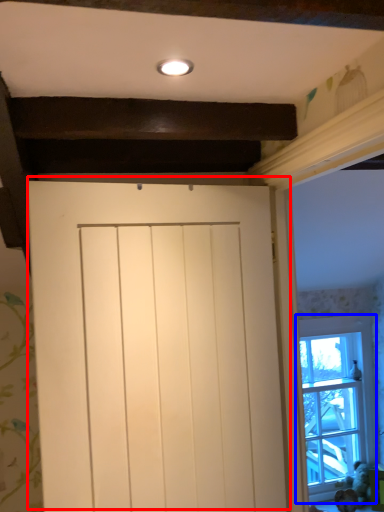
Question: Which object appears closest to the camera in this image, door (highlighted by a red box) or window (highlighted by a blue box)?

Choices:
 (A) door
 (B) window

Answer: (A)